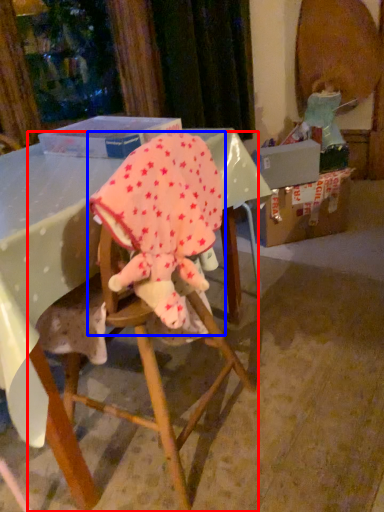
Question: Which object is closer to the camera taking this photo, chair (highlighted by a red box) or baby elephant (highlighted by a blue box)?

Choices:
 (A) chair
 (B) baby elephant

Answer: (B)